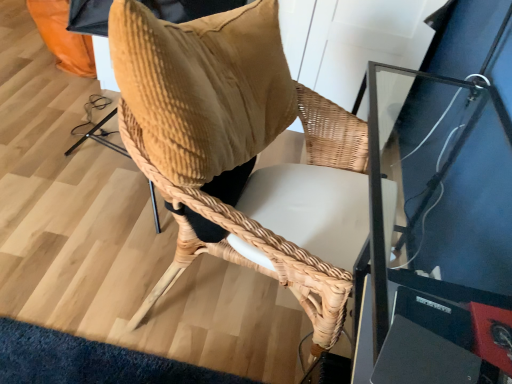
Find the location of `woven wood chair at center`. woven wood chair at center is located at coordinates (216, 139).

What do you see at coordinates (216, 139) in the screenshot?
I see `woven wood chair at center` at bounding box center [216, 139].

The image size is (512, 384). Describe the element at coordinates (202, 86) in the screenshot. I see `velvet brown bean bag chair at center` at that location.

The height and width of the screenshot is (384, 512). Identify the location of velvet brown bean bag chair at center. (202, 86).

What is the approximate height of velvet brown bean bag chair at center?

velvet brown bean bag chair at center is 15.41 inches tall.

Where is `woven wood chair at center`? This screenshot has width=512, height=384. woven wood chair at center is located at coordinates pos(216,139).

Considering the positions of objects velvet brown bean bag chair at center and woven wood chair at center in the image provided, who is more to the left, velvet brown bean bag chair at center or woven wood chair at center?

velvet brown bean bag chair at center is more to the left.

Considering the relative positions of velvet brown bean bag chair at center and woven wood chair at center in the image provided, is velvet brown bean bag chair at center in front of woven wood chair at center?

Yes.

Which point is more forward, [188,59] or [263,137]?

Positioned in front is point [188,59].

From the image's perspective, is velvet brown bean bag chair at center located above or below woven wood chair at center?

Based on their image positions, velvet brown bean bag chair at center is located above woven wood chair at center.

From a real-world perspective, is velvet brown bean bag chair at center physically located above or below woven wood chair at center?

From a real-world perspective, velvet brown bean bag chair at center is physically above woven wood chair at center.

In terms of width, does velvet brown bean bag chair at center look wider or thinner when compared to woven wood chair at center?

velvet brown bean bag chair at center is thinner than woven wood chair at center.

Considering the sizes of objects velvet brown bean bag chair at center and woven wood chair at center in the image provided, who is shorter, velvet brown bean bag chair at center or woven wood chair at center?

velvet brown bean bag chair at center.

In terms of size, does velvet brown bean bag chair at center appear bigger or smaller than woven wood chair at center?

In the image, velvet brown bean bag chair at center appears to be smaller than woven wood chair at center.

Is velvet brown bean bag chair at center outside of woven wood chair at center?

No, velvet brown bean bag chair at center is not outside of woven wood chair at center.

Is velvet brown bean bag chair at center positioned far away from woven wood chair at center?

Actually, velvet brown bean bag chair at center and woven wood chair at center are a little close together.

Is velvet brown bean bag chair at center turned away from woven wood chair at center?

velvet brown bean bag chair at center is not turned away from woven wood chair at center.

How different are the orientations of velvet brown bean bag chair at center and woven wood chair at center in degrees?

They differ by 5.37e-05 degrees in their facing directions.

At what (x,y) coordinates should I click in order to perform the action: click on bean bag chair on the left side of woven wood chair at center. Please return your answer as a coordinate pair (x, y). This screenshot has height=384, width=512. Looking at the image, I should click on (202, 86).

In the image, is woven wood chair at center on the left side or the right side of velvet brown bean bag chair at center?

woven wood chair at center is to the right of velvet brown bean bag chair at center.

In the image, is woven wood chair at center positioned in front of or behind velvet brown bean bag chair at center?

woven wood chair at center is positioned farther from the viewer than velvet brown bean bag chair at center.

Which is closer, (182, 157) or (161, 127)?

The point (161, 127) is more forward.

Consider the image. From the image's perspective, is woven wood chair at center located beneath velvet brown bean bag chair at center?

Correct, woven wood chair at center appears lower than velvet brown bean bag chair at center in the image.

Based on the photo, from a real-world perspective, which object rests below the other?

woven wood chair at center, from a real-world perspective.

Can you confirm if woven wood chair at center is wider than velvet brown bean bag chair at center?

Correct, the width of woven wood chair at center exceeds that of velvet brown bean bag chair at center.

Does woven wood chair at center have a greater height compared to velvet brown bean bag chair at center?

Indeed, woven wood chair at center has a greater height compared to velvet brown bean bag chair at center.

Between woven wood chair at center and velvet brown bean bag chair at center, which one has smaller size?

velvet brown bean bag chair at center is smaller.

Is woven wood chair at center completely or partially outside of velvet brown bean bag chair at center?

Indeed, woven wood chair at center is completely outside velvet brown bean bag chair at center.

Is woven wood chair at center not near velvet brown bean bag chair at center?

That's not correct — woven wood chair at center is a little close to velvet brown bean bag chair at center.

Is velvet brown bean bag chair at center at the back of woven wood chair at center?

No, velvet brown bean bag chair at center is not at the back of woven wood chair at center.

What's the angular difference between woven wood chair at center and velvet brown bean bag chair at center's facing directions?

They differ by 5.37e-05 degrees in their facing directions.

This screenshot has width=512, height=384. I want to click on chair to the right of velvet brown bean bag chair at center, so click(x=216, y=139).

You are a GUI agent. You are given a task and a screenshot of the screen. Output one action in this format:
    pyautogui.click(x=<x>, y=<y>)
    Task: Click on the chair that appears below the velvet brown bean bag chair at center (from a real-world perspective)
    This screenshot has width=512, height=384.
    Given the screenshot: What is the action you would take?
    pyautogui.click(x=216, y=139)

Locate an element on the screen. bean bag chair located above the woven wood chair at center (from a real-world perspective) is located at coordinates (202, 86).